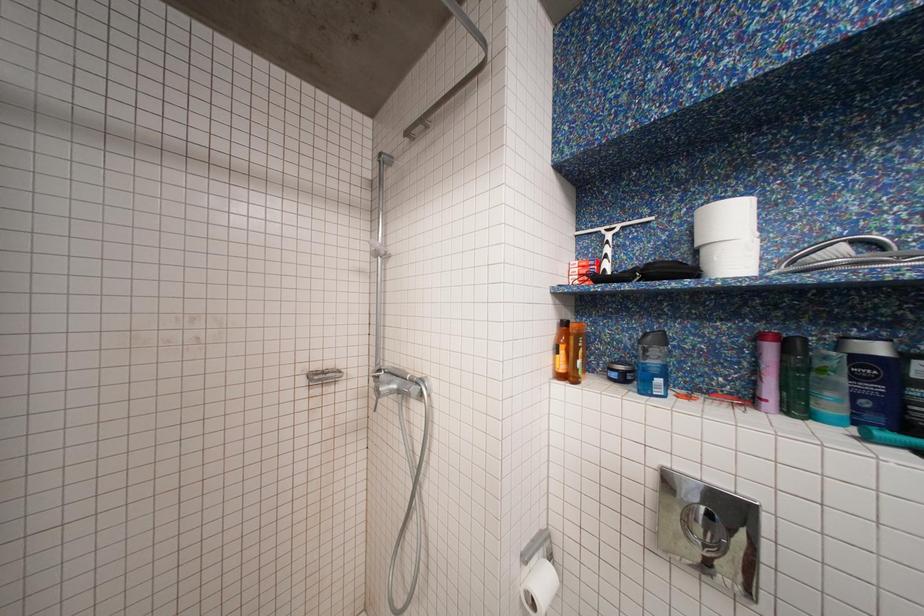
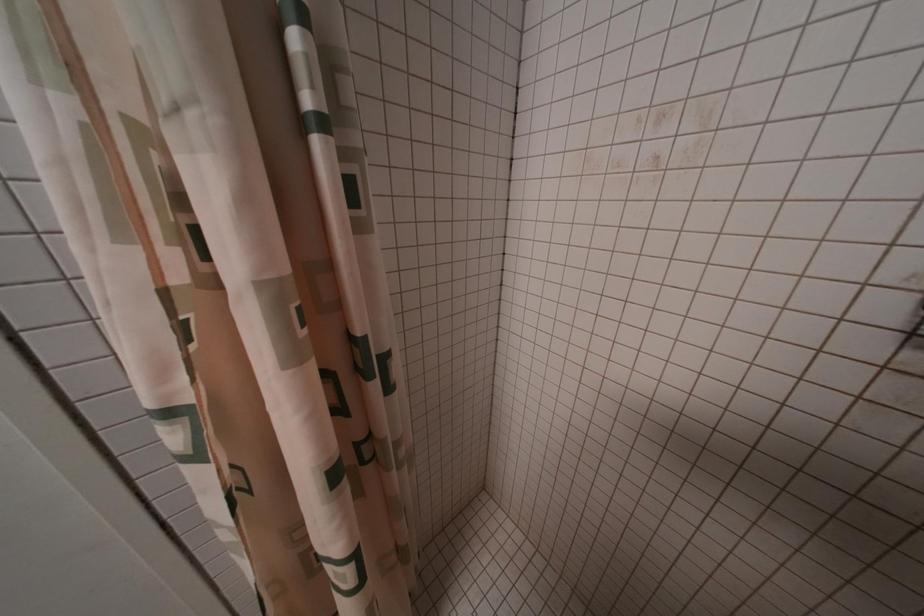
The first image is from the beginning of the video and the second image is from the end. How did the camera likely rotate when shooting the video?

The camera rotated toward left-down.